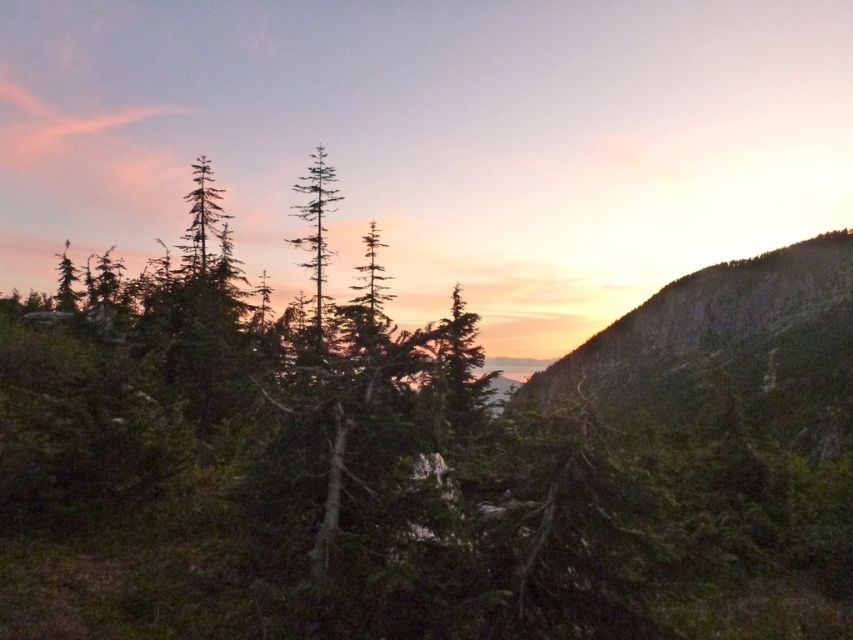
You are an explorer standing in the foreground of this landscape. You need to move from your current position to the green textured rock at right. Which direction should you head relative to the green matte tree at center?

You should head to the right of the green matte tree at center to reach the green textured rock at right.

You are an explorer trying to navigate through this landscape. You see the green textured rock at right and the green matte tree at center. Which object is easier to approach from your current position?

The green textured rock at right is closer to the viewer than the green matte tree at center, so it is easier to approach the green textured rock at right first.